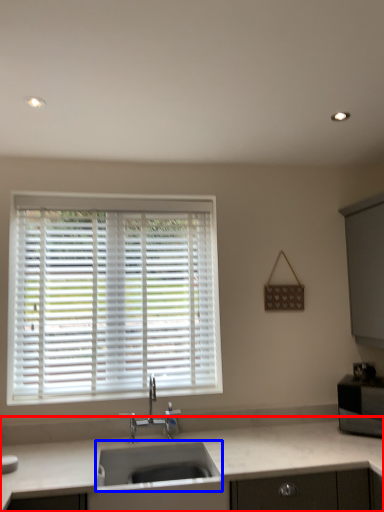
Question: Which of the following is the farthest to the observer, countertop (highlighted by a red box) or sink (highlighted by a blue box)?

Choices:
 (A) countertop
 (B) sink

Answer: (B)